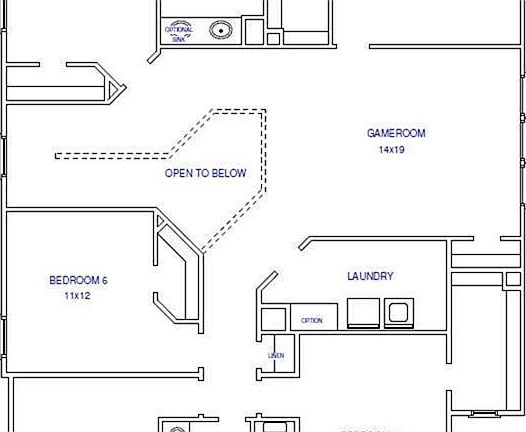
The height and width of the screenshot is (432, 526). Identify the location of room. (306, 19).